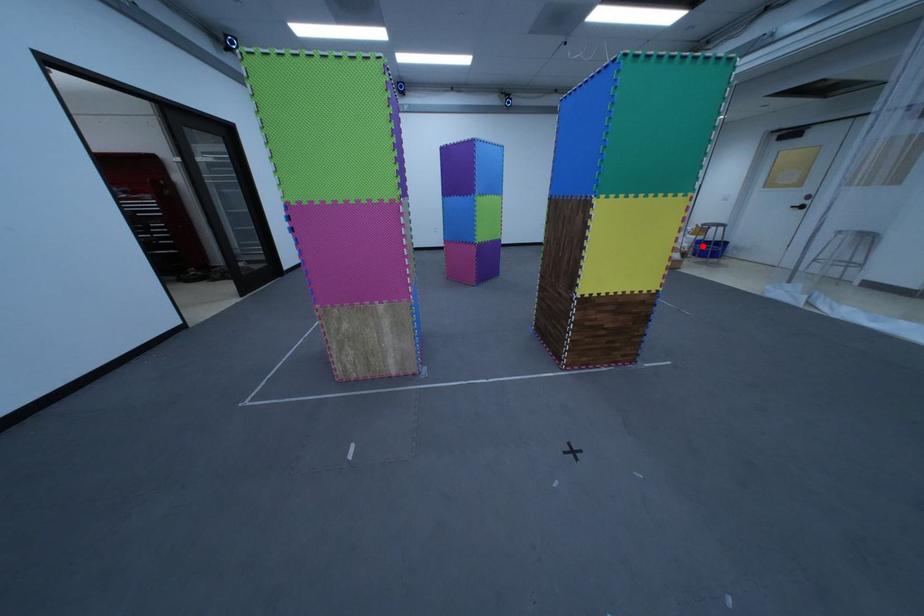
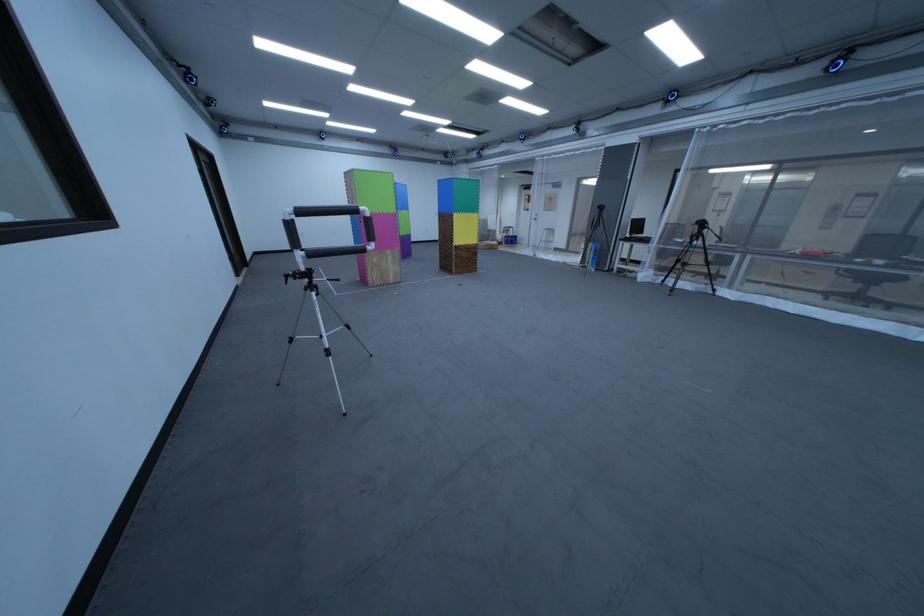
The point at the highlighted location is marked in the first image. Where is the corresponding point in the second image?

(517, 238)